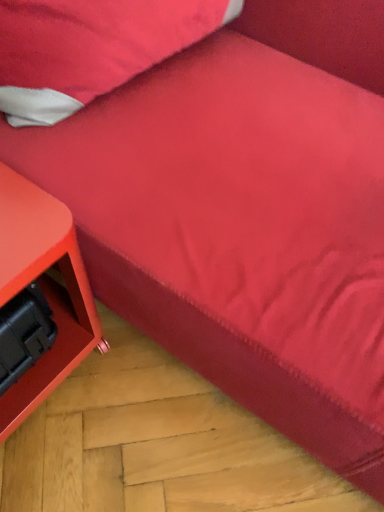
Question: Visually, is velvety red pillow at upper left positioned to the left or to the right of matte orange side table at lower left?

Choices:
 (A) right
 (B) left

Answer: (A)

Question: From the image's perspective, is velvety red pillow at upper left located above or below matte orange side table at lower left?

Choices:
 (A) below
 (B) above

Answer: (B)

Question: Is point (1, 5) closer or farther from the camera than point (26, 373)?

Choices:
 (A) closer
 (B) farther

Answer: (A)

Question: Is matte orange side table at lower left taller or shorter than velvety red pillow at upper left?

Choices:
 (A) tall
 (B) short

Answer: (A)

Question: Would you say matte orange side table at lower left is to the left or to the right of velvety red pillow at upper left in the picture?

Choices:
 (A) right
 (B) left

Answer: (B)

Question: Is matte orange side table at lower left wider or thinner than velvety red pillow at upper left?

Choices:
 (A) wide
 (B) thin

Answer: (A)

Question: In the image, is matte orange side table at lower left positioned in front of or behind velvety red pillow at upper left?

Choices:
 (A) behind
 (B) front

Answer: (B)